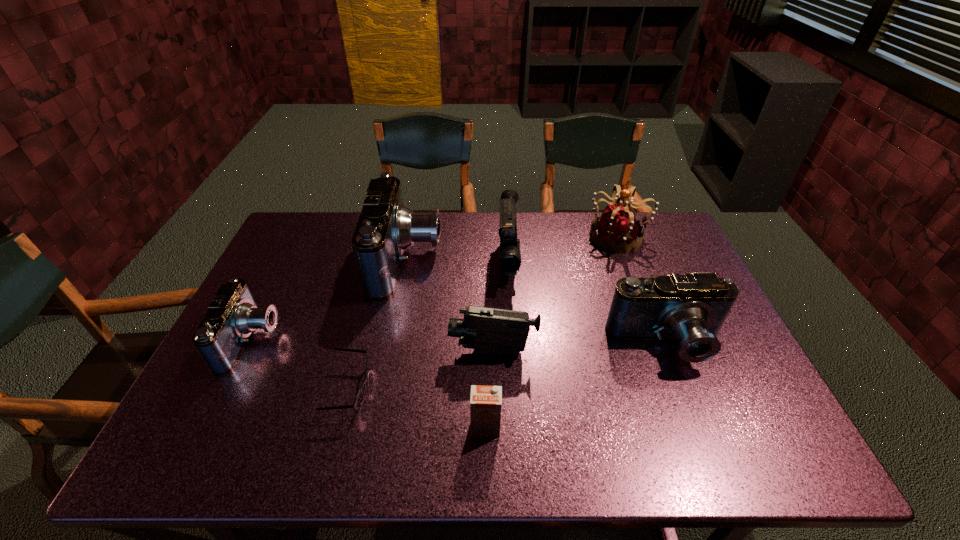
Find the location of a particular element. free space between the second camcorder from left to right and the black spectacles is located at coordinates (378, 325).

Locate an element on the screen. unoccupied area between the smaller black camcorder and the second smallest blue camcorder is located at coordinates (580, 348).

This screenshot has height=540, width=960. I want to click on vacant area that lies between the orange juice and the second smallest blue camcorder, so [x=576, y=386].

Identify the location of unoccupied area between the bigger black camcorder and the shortest object. (429, 326).

Image resolution: width=960 pixels, height=540 pixels. I want to click on vacant point located between the rightmost blue camcorder and the bigger black camcorder, so click(588, 303).

Identify which object is the second closest to the nearer black camcorder. Please provide its 2D coordinates. Your answer should be formatted as a tuple, i.e. [(x, y)], where the tuple contains the x and y coordinates of a point satisfying the conditions above.

[(485, 401)]

The image size is (960, 540). I want to click on the second closest object relative to the farther black camcorder, so click(x=486, y=330).

Locate which camcorder is the closest to the farther black camcorder. Please provide its 2D coordinates. Your answer should be formatted as a tuple, i.e. [(x, y)], where the tuple contains the x and y coordinates of a point satisfying the conditions above.

[(385, 228)]

Locate which camcorder is the third closest to the farther black camcorder. Please provide its 2D coordinates. Your answer should be formatted as a tuple, i.e. [(x, y)], where the tuple contains the x and y coordinates of a point satisfying the conditions above.

[(691, 308)]

Find the location of a particular element. the closest blue camcorder to the tiara is located at coordinates (691, 308).